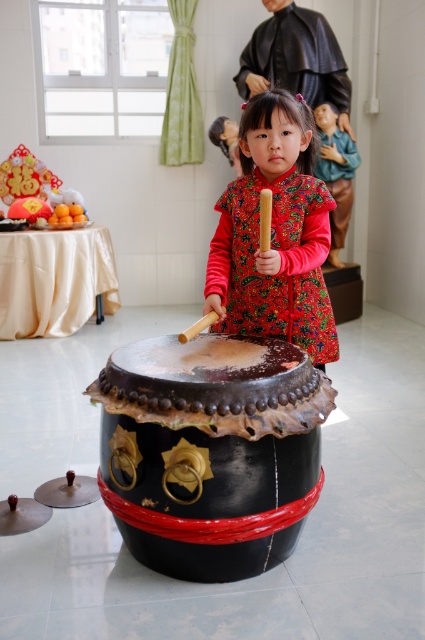
What object is located at the coordinates point [210,451]?

The black leather drum at center is located at point [210,451].

The girl is holding drumsticks and is about to play an instrument. Given the scene, which object is positioned lower in the image between the black leather drum at center and the floral brocade dress at center?

The black leather drum at center is located below the floral brocade dress at center, so the drum is positioned lower in the image.